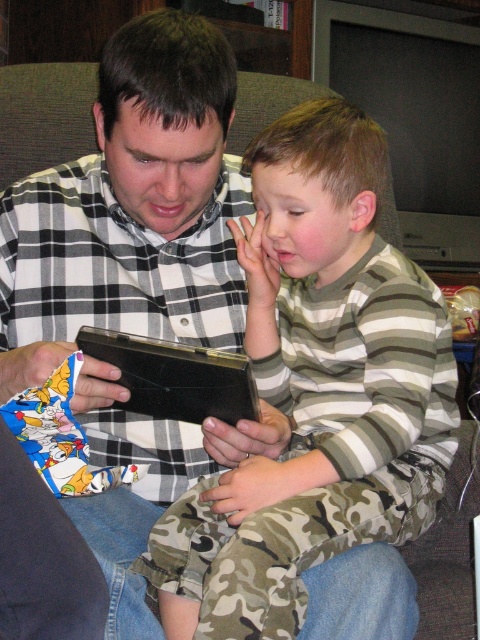
You are a photographer who wants to capture a candid shot of the striped cotton shirt at center and the black leather tablet at center. Since you can only focus on one object at a time, which one should you choose to ensure the other remains in the background?

The striped cotton shirt at center is located above the black leather tablet at center, so if you focus on the striped cotton shirt at center, the black leather tablet at center will naturally appear in the background.

You are a delivery robot that is 12 inches wide. You are currently positioned in the room and need to move to the point at coordinates (241, 512). Can you safely navigate to that point without encountering any obstacles?

The distance between the point at coordinates (241, 512) and the viewer is 33.31 inches. Since the robot is 12 inches wide, there should be enough space to navigate to that point as long as there are no other obstacles in the path.

Based on the scene described, which object, the striped cotton shirt at center or the plaid shirt at center, is shorter in height?

The striped cotton shirt at center is shorter in height compared to the plaid shirt at center.